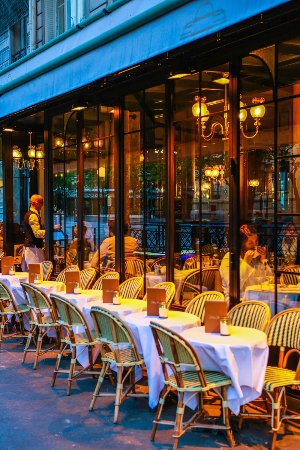
Identify the location of lights. Image resolution: width=300 pixels, height=450 pixels. (199, 105), (207, 118), (243, 116), (257, 114), (32, 150), (14, 150).